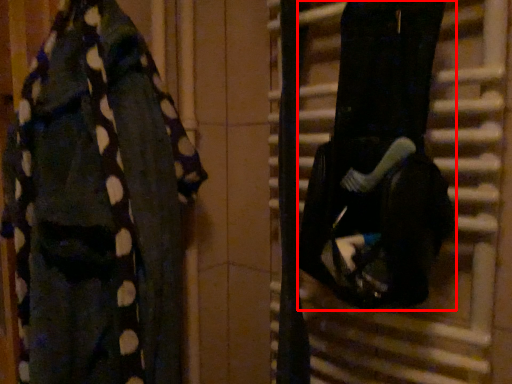
Question: From the image's perspective, where is wide (annotated by the red box) located relative to underclothes?

Choices:
 (A) above
 (B) below

Answer: (A)